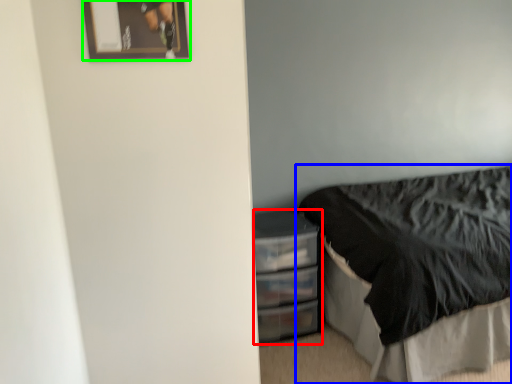
Question: Considering the real-world distances, which object is farthest from file cabinet (highlighted by a red box)? bed (highlighted by a blue box) or picture frame (highlighted by a green box)?

Choices:
 (A) bed
 (B) picture frame

Answer: (B)